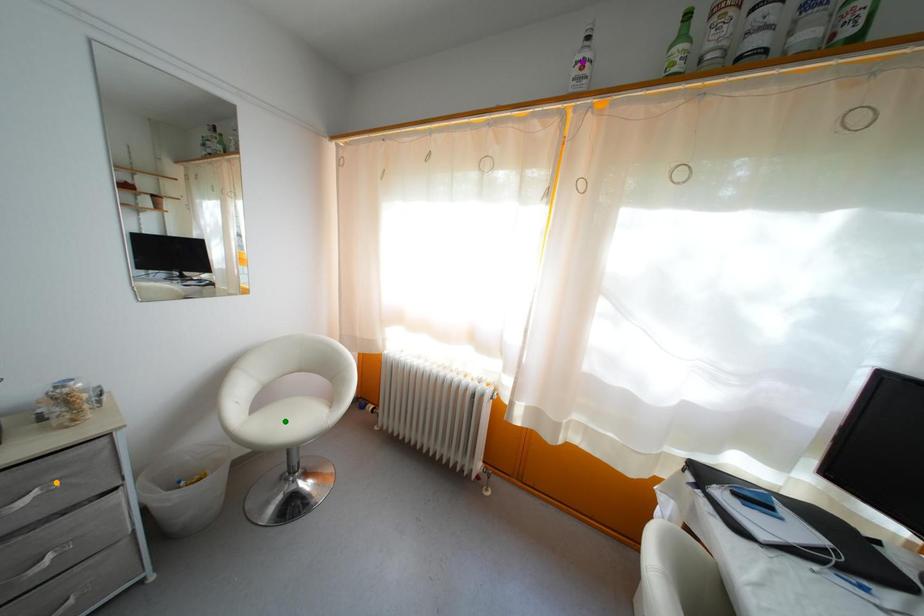
Order these from nearest to farthest:
green point
purple point
orange point

orange point, purple point, green point